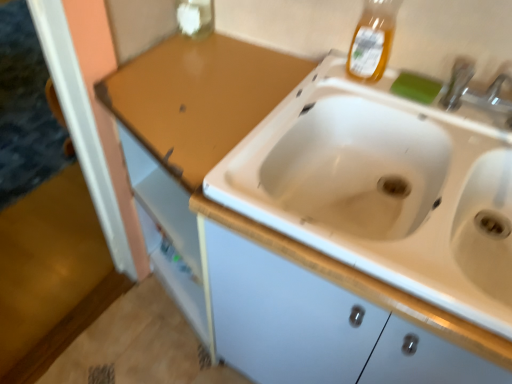
Question: Relative to green sponge at upper right, is transparent glass bottle at upper center, the 2th bottle from the right, in front or behind?

Choices:
 (A) behind
 (B) front

Answer: (A)

Question: Considering the positions of point (197, 29) and point (421, 79), is point (197, 29) closer or farther from the camera than point (421, 79)?

Choices:
 (A) farther
 (B) closer

Answer: (A)

Question: Which object is positioned closest to the transparent glass bottle at upper center, which is the first bottle in left-to-right order?

Choices:
 (A) green sponge at upper right
 (B) translucent amber liquid at upper right, the first bottle from the front

Answer: (B)

Question: Which object is positioned closest to the transparent glass bottle at upper center, the 1th bottle from the back?

Choices:
 (A) translucent amber liquid at upper right, which is counted as the second bottle, starting from the left
 (B) green sponge at upper right

Answer: (A)